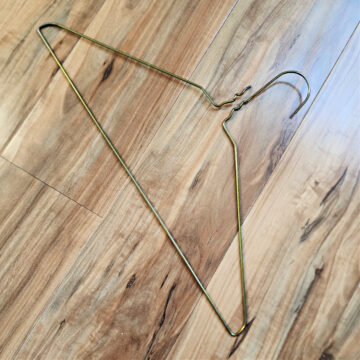
Locate an element on the screen. Image resolution: width=360 pixels, height=360 pixels. right corner of joint between wood slats on left is located at coordinates (103, 217).